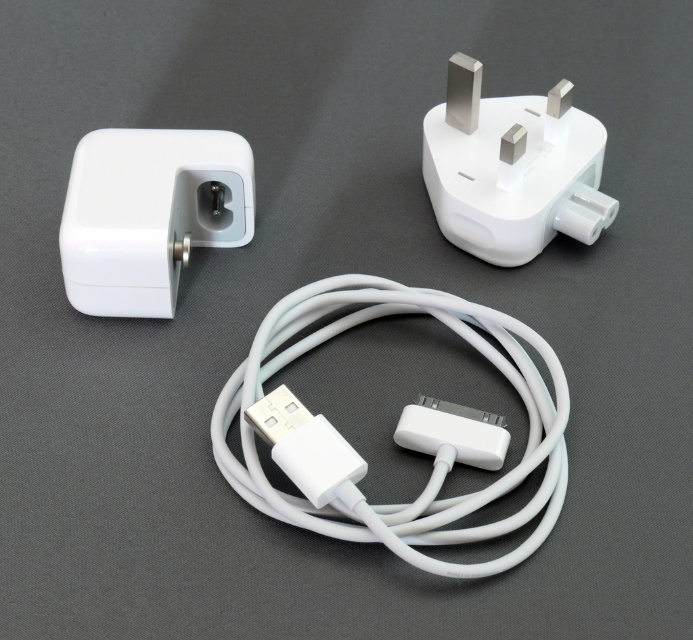
You are holding a phone that needs charging and you see the white matte cable at center and the white matte power adapter at upper left. Which one should you pick up first to start charging your phone?

You should pick up the white matte cable at center first because it is closer to you than the white matte power adapter at upper left, allowing easier access to connect it to your phone before reaching for the adapter.

Based on the photo, you are organizing a drawer and need to place the white matte cable at center and the white plastic plug at upper right. Since the drawer is narrow, you want to know which item is on the left to slide it in first. Which one is positioned to the left?

The white matte cable at center is positioned on the left side of the white plastic plug at upper right, so it is on the left and should be slid in first.

You are setting up a device and need to connect the white matte cable at center to the white plastic plug at upper right. Based on their positions in the image, can you determine if the cable is already plugged into the plug?

The white matte cable at center is in front of the white plastic plug at upper right, so it is not plugged in yet. To connect them, you would need to move the cable towards the plug.